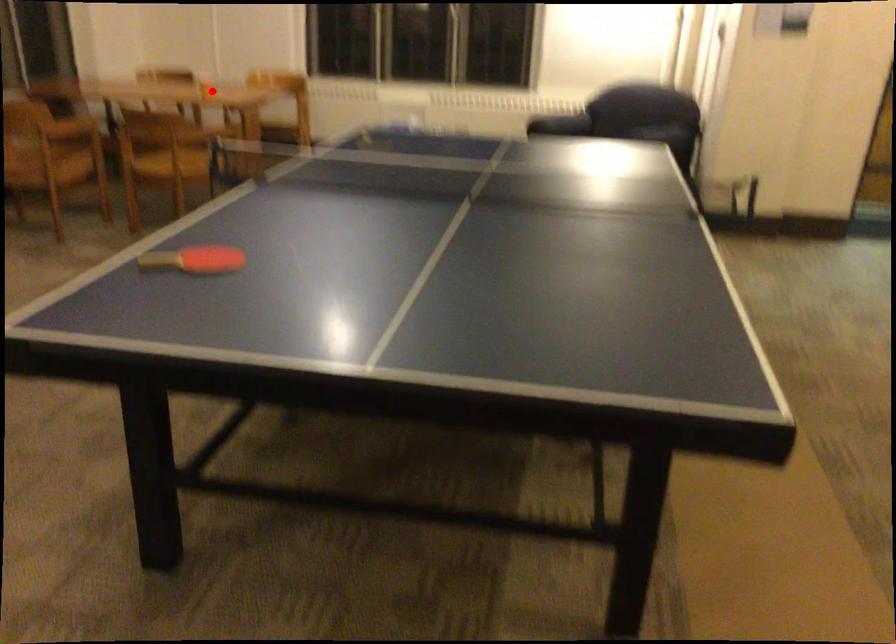
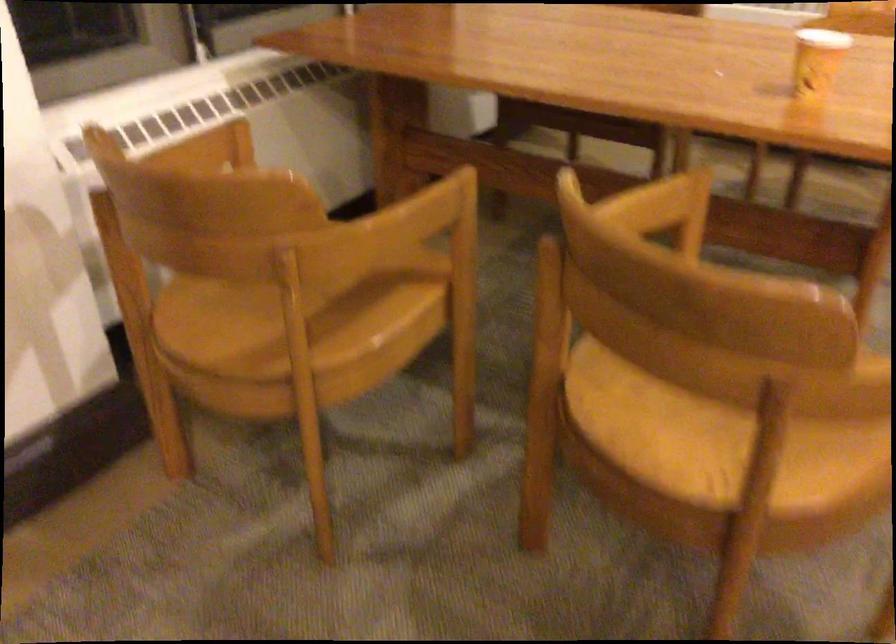
Question: A red point is marked in image1. In image2, is the corresponding 3D point closer to the camera or farther? Reply with the corresponding letter.

Choices:
 (A) The corresponding 3D point is closer.
 (B) The corresponding 3D point is farther.

Answer: (A)